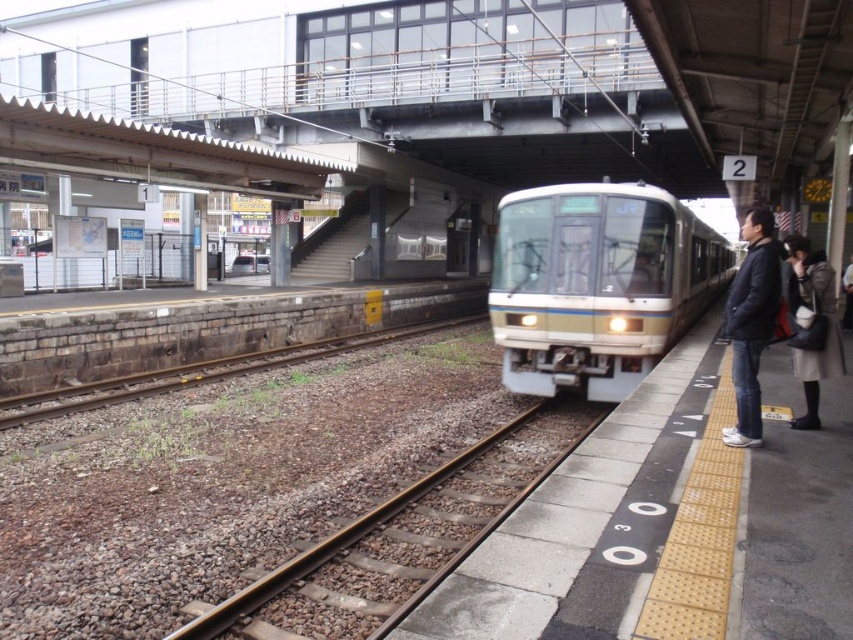
Question: Is black matte jacket at right further to the viewer compared to matte gray coat at right?

Choices:
 (A) yes
 (B) no

Answer: (B)

Question: Does brown gravel train track at center have a larger size compared to black matte jacket at right?

Choices:
 (A) yes
 (B) no

Answer: (B)

Question: Which point is closer to the camera?

Choices:
 (A) (6, 419)
 (B) (276, 573)

Answer: (B)

Question: Which point is closer to the camera?

Choices:
 (A) (811, 276)
 (B) (163, 387)

Answer: (A)

Question: Which point is farther to the camera?

Choices:
 (A) matte white train at center
 (B) matte gray coat at right
 (C) brown gravel train track at center
 (D) brown gravel track at center

Answer: (A)

Question: Is matte white train at center to the right of black matte jacket at right from the viewer's perspective?

Choices:
 (A) yes
 (B) no

Answer: (B)